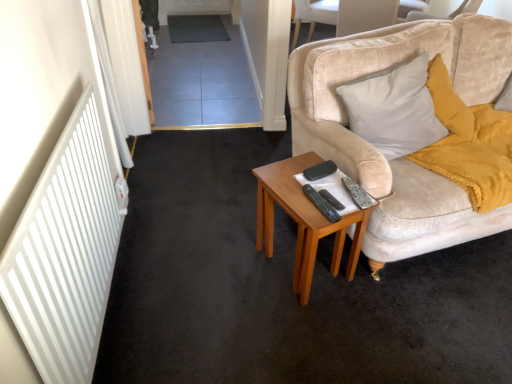
At what (x,y) coordinates should I click in order to perform the action: click on vacant space that is in between black plastic remote control at center, which is the second remote control from right to left, and silver metallic remote control at right, positioned as the 3th remote control in left-to-right order. Please return your answer as a coordinate pair (x, y). Looking at the image, I should click on (338, 196).